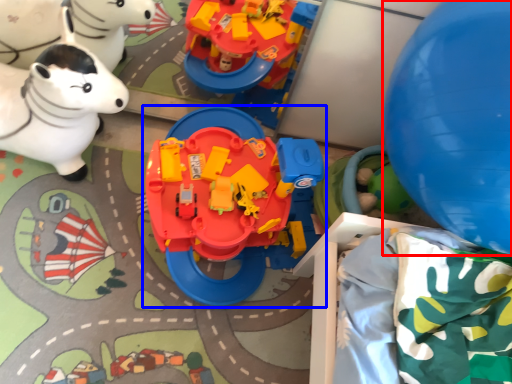
Question: Which object appears farthest to the camera in this image, balloon (highlighted by a red box) or toy (highlighted by a blue box)?

Choices:
 (A) balloon
 (B) toy

Answer: (B)